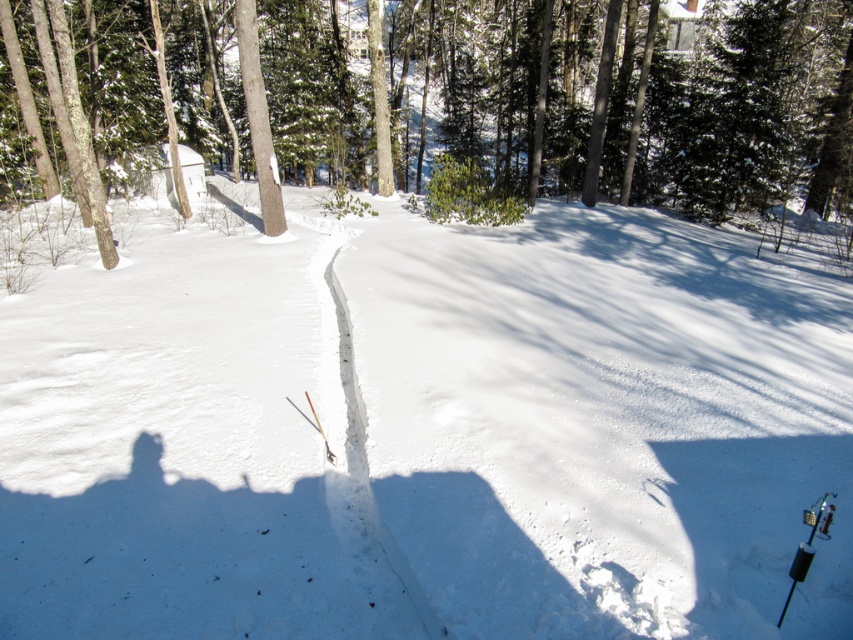
From the picture: Can you confirm if white powdery snow at center is wider than brown smooth tree at upper center?

No, white powdery snow at center is not wider than brown smooth tree at upper center.

Is white powdery snow at center shorter than brown smooth tree at upper center?

Correct, white powdery snow at center is not as tall as brown smooth tree at upper center.

Where is `white powdery snow at center`? white powdery snow at center is located at coordinates (426, 433).

Who is higher up, brown smooth tree at upper center or white snow trail at center?

Positioned higher is brown smooth tree at upper center.

Who is more distant from viewer, (514, 118) or (358, 515)?

Point (514, 118)

Locate an element on the screen. This screenshot has height=640, width=853. brown smooth tree at upper center is located at coordinates (630, 99).

Between point (602, 412) and point (354, 529), which one is positioned in front?

Positioned in front is point (354, 529).

Can you confirm if white powdery snow at center is smaller than white snow trail at center?

Actually, white powdery snow at center might be larger than white snow trail at center.

Between point (204, 408) and point (378, 595), which one is positioned behind?

The point (204, 408) is more distant.

Locate an element on the screen. This screenshot has width=853, height=640. white powdery snow at center is located at coordinates (426, 433).